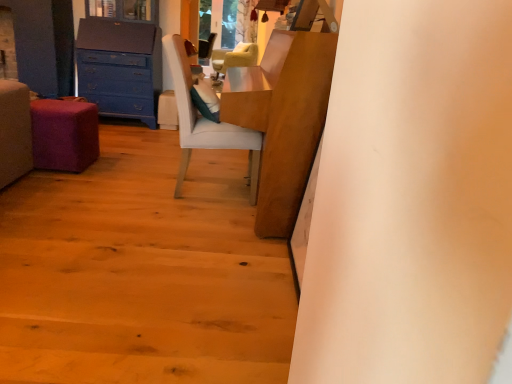
Question: From a real-world perspective, relative to wooden floor at lower left, is velvet beige armchair at center, the 1th chair viewed from the top, vertically above or below?

Choices:
 (A) above
 (B) below

Answer: (A)

Question: From their relative heights in the image, would you say velvet beige armchair at center, the 1th chair viewed from the back, is taller or shorter than wooden floor at lower left?

Choices:
 (A) short
 (B) tall

Answer: (B)

Question: Which object is the closest to the velvet beige armchair at center, the 2th chair viewed from the front?

Choices:
 (A) blue painted wood chest of drawers at left
 (B) white fabric chair at center, the first chair in the front-to-back sequence
 (C) purple fabric stool at lower left
 (D) wooden table at center
 (E) wooden floor at lower left

Answer: (B)

Question: Which of these objects is positioned farthest from the velvet beige armchair at center, which is the second chair from bottom to top?

Choices:
 (A) wooden table at center
 (B) purple fabric stool at lower left
 (C) white fabric chair at center, which ranks as the 2th chair in top-to-bottom order
 (D) wooden floor at lower left
 (E) blue painted wood chest of drawers at left

Answer: (D)